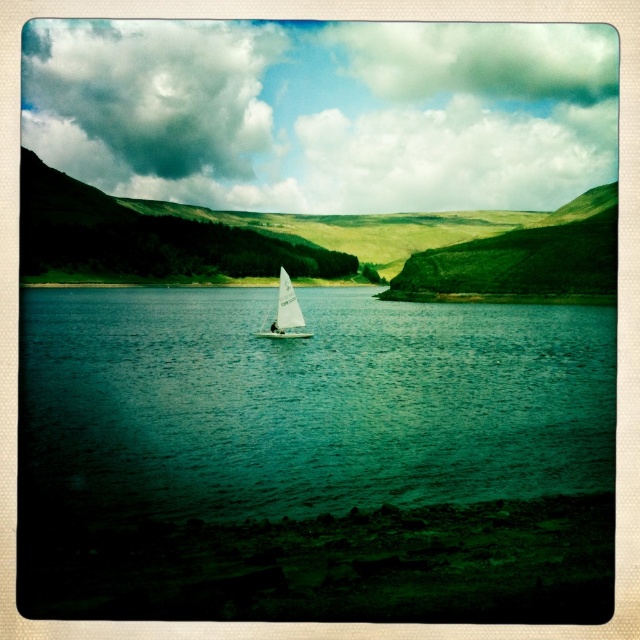
Who is taller, green water at center or white sailboat at center?

With more height is green water at center.

Which of these two, green water at center or white sailboat at center, stands shorter?

white sailboat at center

What do you see at coordinates (308, 403) in the screenshot? I see `green water at center` at bounding box center [308, 403].

I want to click on green water at center, so click(x=308, y=403).